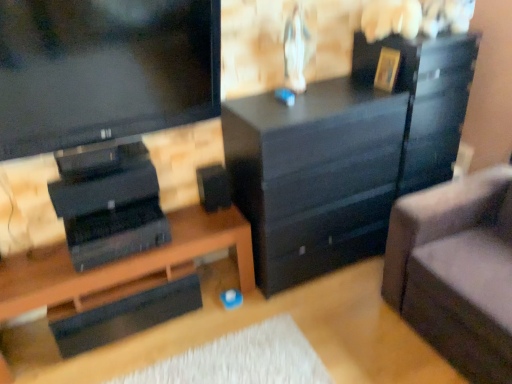
Question: Could you tell me if suede gray couch at right is turned towards gold metallic picture frame at upper right?

Choices:
 (A) yes
 (B) no

Answer: (B)

Question: Is gold metallic picture frame at upper right inside suede gray couch at right?

Choices:
 (A) no
 (B) yes

Answer: (A)

Question: Considering the relative positions of suede gray couch at right and gold metallic picture frame at upper right in the image provided, is suede gray couch at right to the right of gold metallic picture frame at upper right from the viewer's perspective?

Choices:
 (A) yes
 (B) no

Answer: (A)

Question: Is suede gray couch at right at the left side of gold metallic picture frame at upper right?

Choices:
 (A) no
 (B) yes

Answer: (A)

Question: From a real-world perspective, is suede gray couch at right located beneath gold metallic picture frame at upper right?

Choices:
 (A) yes
 (B) no

Answer: (A)

Question: Would you say black matte chest of drawers at center is to the left or to the right of suede gray couch at right in the picture?

Choices:
 (A) left
 (B) right

Answer: (A)

Question: From a real-world perspective, is black matte chest of drawers at center positioned above or below suede gray couch at right?

Choices:
 (A) above
 (B) below

Answer: (A)

Question: Considering their positions, is black matte chest of drawers at center located in front of or behind suede gray couch at right?

Choices:
 (A) front
 (B) behind

Answer: (B)

Question: Is point 249,130 positioned closer to the camera than point 505,334?

Choices:
 (A) farther
 (B) closer

Answer: (A)

Question: Visually, is black matte chest of drawers at center positioned to the left or to the right of black matte desk at lower left?

Choices:
 (A) right
 (B) left

Answer: (A)

Question: From a real-world perspective, is black matte chest of drawers at center physically located above or below black matte desk at lower left?

Choices:
 (A) below
 (B) above

Answer: (B)

Question: From the image's perspective, is black matte chest of drawers at center positioned above or below black matte desk at lower left?

Choices:
 (A) above
 (B) below

Answer: (A)

Question: Is point (353, 56) positioned closer to the camera than point (217, 226)?

Choices:
 (A) closer
 (B) farther

Answer: (B)

Question: Is black matte speaker at center taller or shorter than black matte chest of drawers at center?

Choices:
 (A) short
 (B) tall

Answer: (A)

Question: Does point pos(225,177) appear closer or farther from the camera than point pos(360,102)?

Choices:
 (A) farther
 (B) closer

Answer: (B)